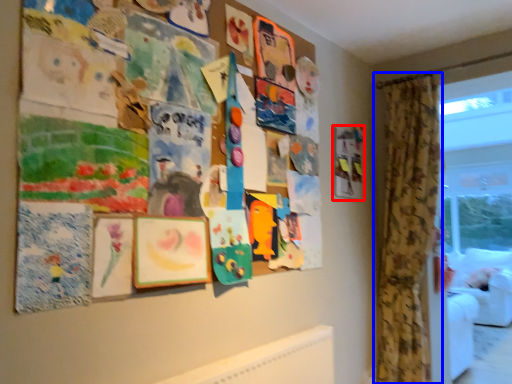
Question: Which object appears farthest to the camera in this image, picture frame (highlighted by a red box) or curtain (highlighted by a blue box)?

Choices:
 (A) picture frame
 (B) curtain

Answer: (A)